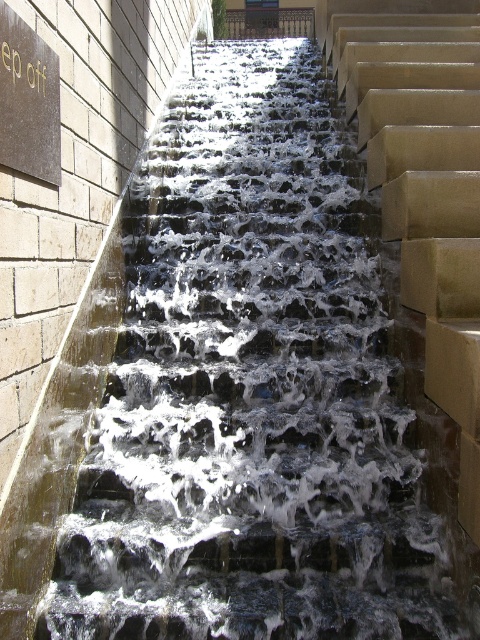
Question: Which point is closer to the camera taking this photo?

Choices:
 (A) (301, 35)
 (B) (27, 100)

Answer: (B)

Question: Considering the relative positions of satin gold stairs at upper center and matte black sign at upper left in the image provided, where is satin gold stairs at upper center located with respect to matte black sign at upper left?

Choices:
 (A) right
 (B) left

Answer: (A)

Question: Is satin gold stairs at upper center positioned at the back of dark brown wrought iron at upper center?

Choices:
 (A) yes
 (B) no

Answer: (B)

Question: Among these objects, which one is nearest to the camera?

Choices:
 (A) dark brown wrought iron at upper center
 (B) matte black sign at upper left
 (C) satin gold stairs at upper center

Answer: (B)

Question: Does matte black sign at upper left have a larger size compared to dark brown wrought iron at upper center?

Choices:
 (A) no
 (B) yes

Answer: (A)

Question: Based on their relative distances, which object is farther from the dark brown wrought iron at upper center?

Choices:
 (A) matte black sign at upper left
 (B) satin gold stairs at upper center

Answer: (B)